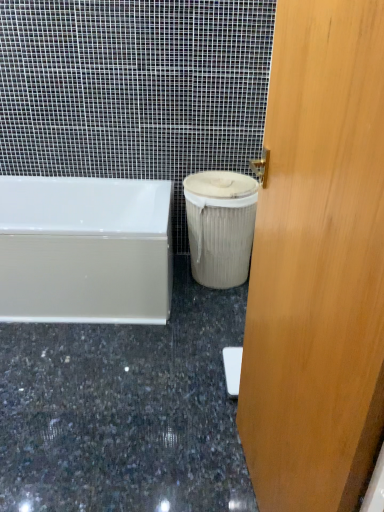
The height and width of the screenshot is (512, 384). Identify the location of blank space situated above granite at lower center (from a real-world perspective). pos(103,367).